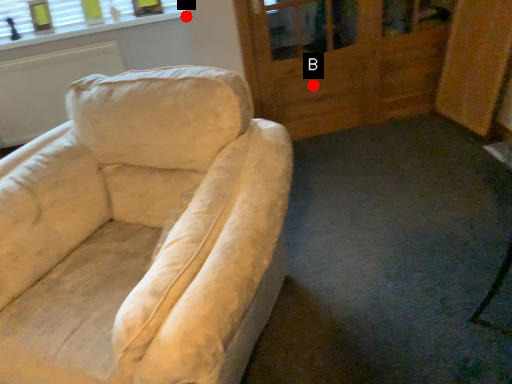
Question: Two points are circled on the image, labeled by A and B beside each circle. Which point is closer to the camera?

Choices:
 (A) A is closer
 (B) B is closer

Answer: (B)